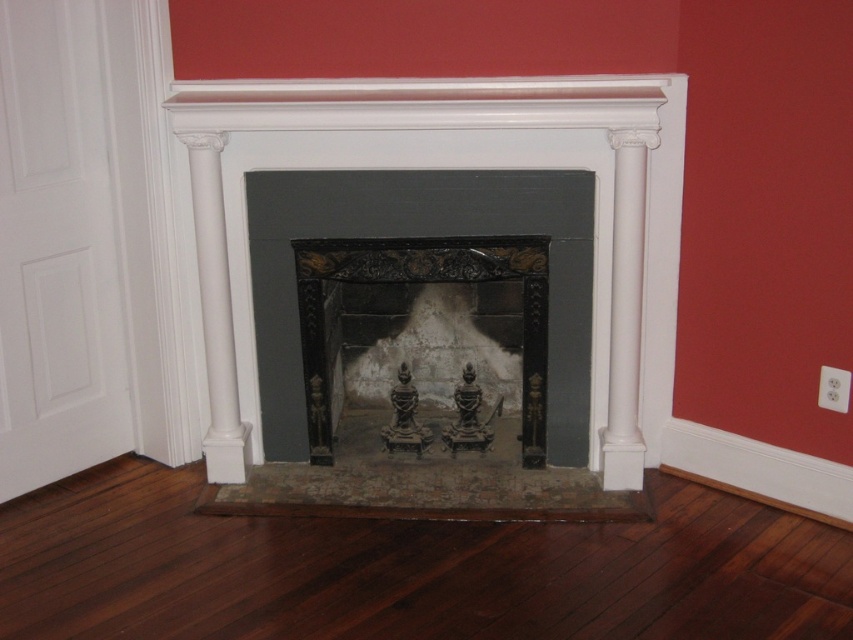
Question: In this image, where is dark brown wood flooring at center located relative to black polished wood fireplace at center?

Choices:
 (A) below
 (B) above

Answer: (A)

Question: Is black marble fireplace at center wider than black polished wood fireplace at center?

Choices:
 (A) yes
 (B) no

Answer: (A)

Question: Among these points, which one is farthest from the camera?

Choices:
 (A) (206, 355)
 (B) (531, 385)
 (C) (628, 564)

Answer: (B)

Question: Does dark brown wood flooring at center have a larger size compared to black polished wood fireplace at center?

Choices:
 (A) no
 (B) yes

Answer: (B)

Question: Which is farther from the black polished wood fireplace at center?

Choices:
 (A) black marble fireplace at center
 (B) dark brown wood flooring at center

Answer: (B)

Question: Which of the following is the closest to the observer?

Choices:
 (A) dark brown wood flooring at center
 (B) black polished wood fireplace at center

Answer: (A)